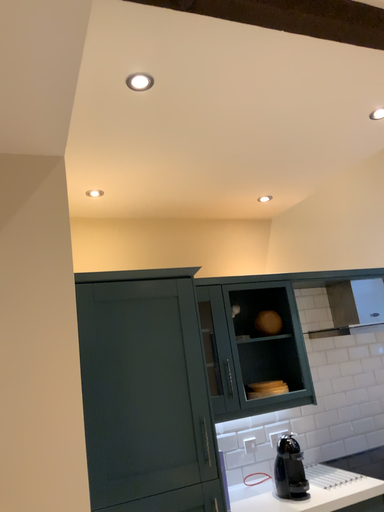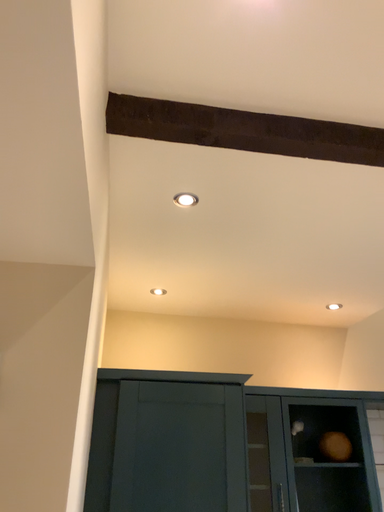
Question: How did the camera likely rotate when shooting the video?

Choices:
 (A) rotated right
 (B) rotated left

Answer: (B)